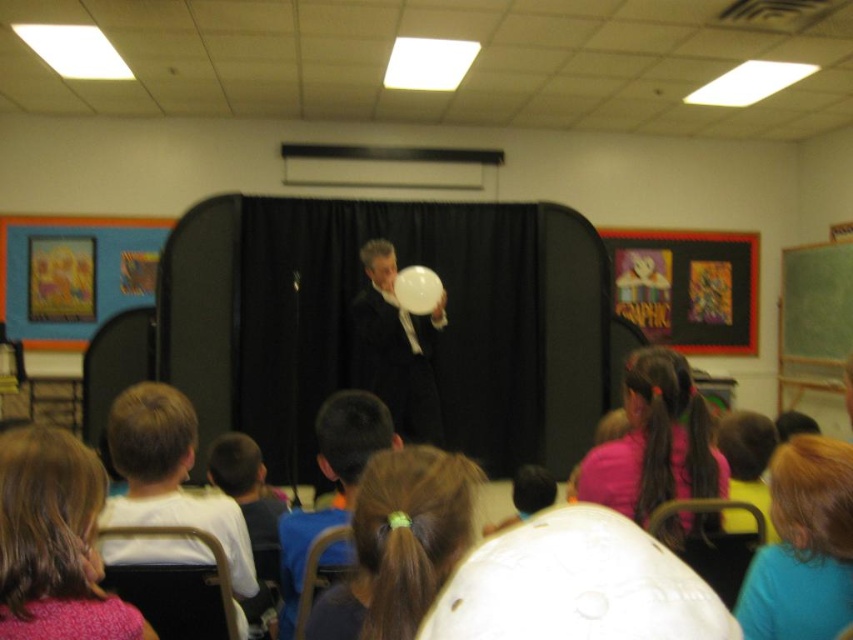
Based on the photo, who is more forward, [32,508] or [291,531]?

Positioned in front is point [32,508].

Is blonde hair at lower left above matte black suit at center?

Indeed, blonde hair at lower left is positioned over matte black suit at center.

Between point (15, 618) and point (283, 637), which one is positioned behind?

The point (283, 637) is more distant.

At what (x,y) coordinates should I click in order to perform the action: click on blonde hair at lower left. Please return your answer as a coordinate pair (x, y). Looking at the image, I should click on (54, 541).

Who is shorter, pink fabric ponytail at center or white glossy balloon at center?

pink fabric ponytail at center is shorter.

Is point (688, 432) closer to viewer compared to point (416, 374)?

Yes, it is.

What are the coordinates of `pink fabric ponytail at center` in the screenshot? It's located at (654, 442).

Who is higher up, blue fabric shirt at lower right or pink fabric ponytail at center?

pink fabric ponytail at center

Is blue fabric shirt at lower right positioned in front of pink fabric ponytail at center?

That is True.

Identify the location of blue fabric shirt at lower right. Image resolution: width=853 pixels, height=640 pixels. (804, 545).